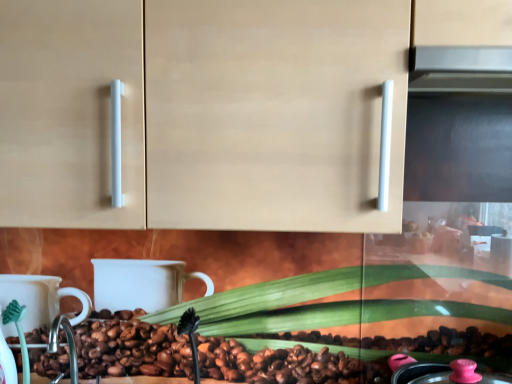
Image resolution: width=512 pixels, height=384 pixels. Identify the location of matte wood cabinet at center. [x=215, y=109].

This screenshot has height=384, width=512. Describe the element at coordinates (215, 109) in the screenshot. I see `matte wood cabinet at center` at that location.

Where is `matte wood cabinet at center`? This screenshot has width=512, height=384. matte wood cabinet at center is located at coordinates (215, 109).